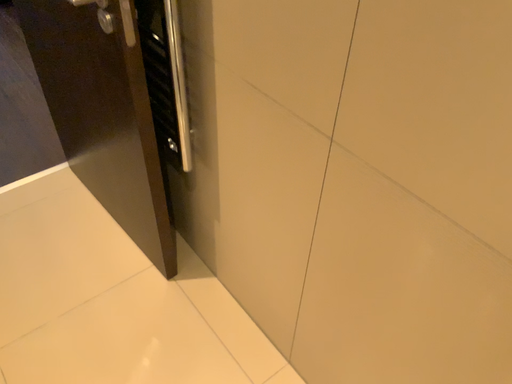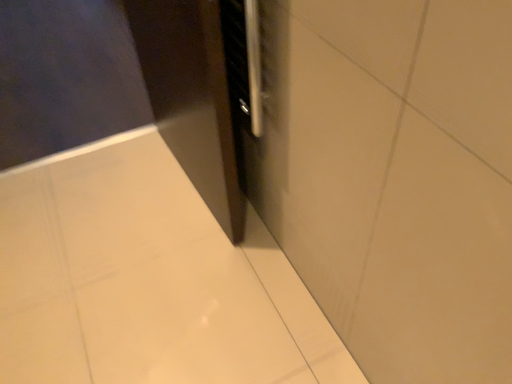
Question: Which way did the camera rotate in the video?

Choices:
 (A) rotated right
 (B) rotated left

Answer: (B)